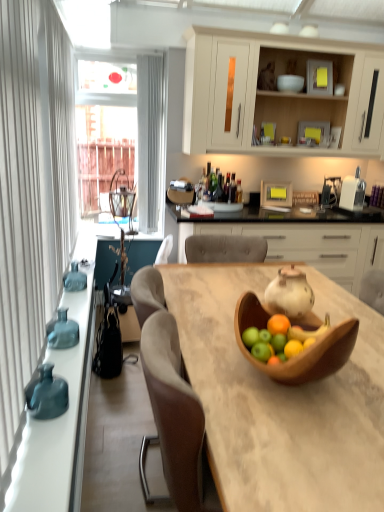
Question: Is teal glass vase at left, which is the third vase in bottom-to-top order, facing towards wooden bowl at center?

Choices:
 (A) yes
 (B) no

Answer: (B)

Question: Does teal glass vase at left, which appears as the 3th vase when viewed from the front, have a greater width compared to wooden bowl at center?

Choices:
 (A) no
 (B) yes

Answer: (A)

Question: Is teal glass vase at left, the 1th vase viewed from the top, beside wooden bowl at center?

Choices:
 (A) no
 (B) yes

Answer: (A)

Question: Considering the relative positions of teal glass vase at left, which appears as the 3th vase when viewed from the front, and wooden bowl at center in the image provided, is teal glass vase at left, which appears as the 3th vase when viewed from the front, to the right of wooden bowl at center from the viewer's perspective?

Choices:
 (A) no
 (B) yes

Answer: (A)

Question: From a real-world perspective, does teal glass vase at left, which is the third vase in bottom-to-top order, stand above wooden bowl at center?

Choices:
 (A) no
 (B) yes

Answer: (A)

Question: From the image's perspective, is wooden table at center located above or below wooden bowl at center?

Choices:
 (A) below
 (B) above

Answer: (A)

Question: Is wooden table at center wider or thinner than wooden bowl at center?

Choices:
 (A) wide
 (B) thin

Answer: (A)

Question: Based on their sizes in the image, would you say wooden table at center is bigger or smaller than wooden bowl at center?

Choices:
 (A) small
 (B) big

Answer: (B)

Question: Considering the relative positions of wooden table at center and wooden bowl at center in the image provided, is wooden table at center to the left or to the right of wooden bowl at center?

Choices:
 (A) left
 (B) right

Answer: (B)

Question: Relative to matte blue vase at left, which is counted as the 1th vase, starting from the bottom, is teal glass vase at left, which is counted as the 2th vase, starting from the back, in front or behind?

Choices:
 (A) behind
 (B) front

Answer: (A)

Question: From a real-world perspective, is teal glass vase at left, which is the second vase in top-to-bottom order, positioned above or below matte blue vase at left, the third vase viewed from the back?

Choices:
 (A) above
 (B) below

Answer: (A)

Question: Considering the relative positions of teal glass vase at left, which is counted as the 2th vase, starting from the back, and matte blue vase at left, the third vase viewed from the back, in the image provided, is teal glass vase at left, which is counted as the 2th vase, starting from the back, to the left or to the right of matte blue vase at left, the third vase viewed from the back,?

Choices:
 (A) right
 (B) left

Answer: (B)

Question: From the image's perspective, is teal glass vase at left, marked as the 2th vase in a bottom-to-top arrangement, above or below matte blue vase at left, the third vase viewed from the back?

Choices:
 (A) below
 (B) above

Answer: (B)

Question: From a real-world perspective, is wooden bowl at center above or below matte white teapot at center?

Choices:
 (A) below
 (B) above

Answer: (B)

Question: Is wooden bowl at center wider or thinner than matte white teapot at center?

Choices:
 (A) wide
 (B) thin

Answer: (B)